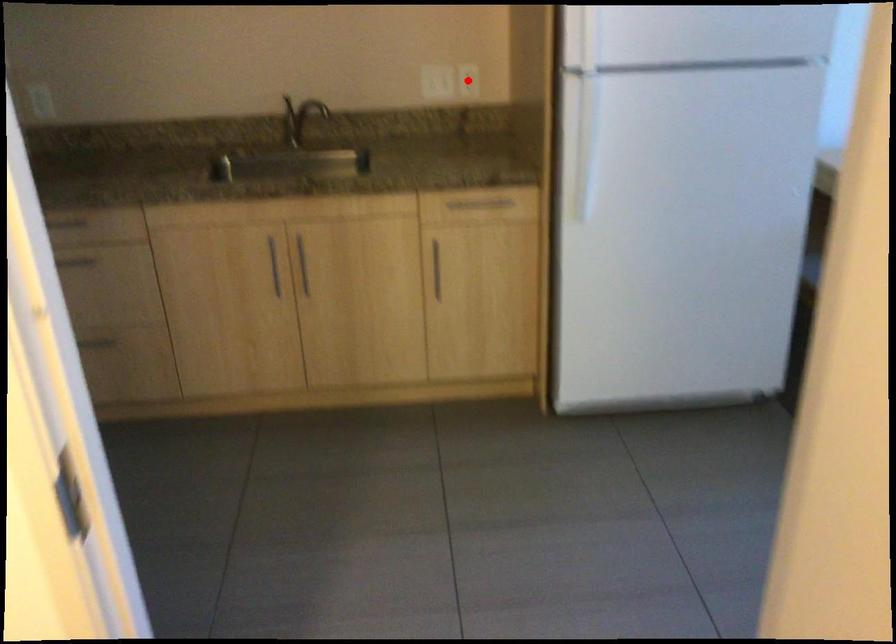
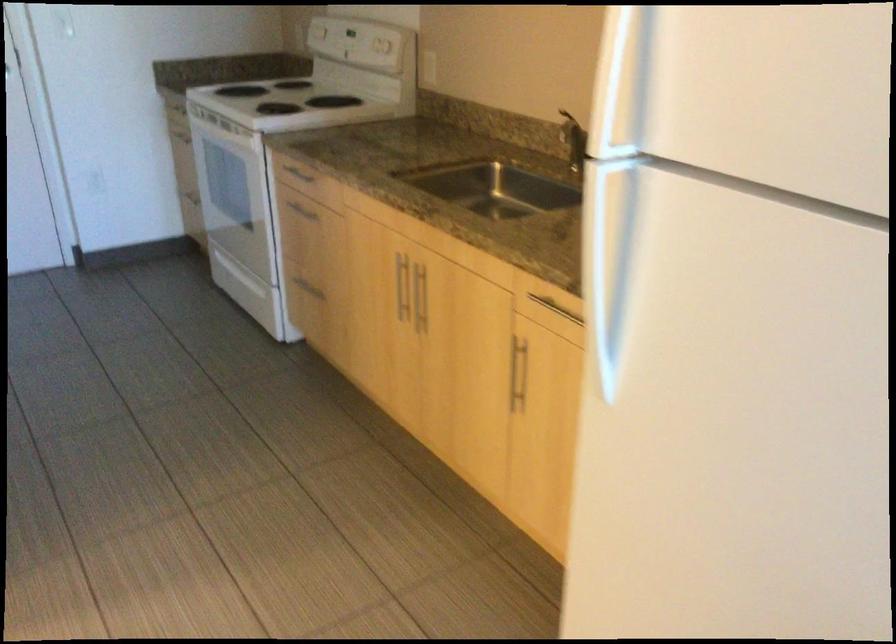
Question: I am providing you with two images of the same scene from different viewpoints. A red point is marked on the first image. Is the red point's position out of view in image 2?

Choices:
 (A) Yes
 (B) No

Answer: (A)